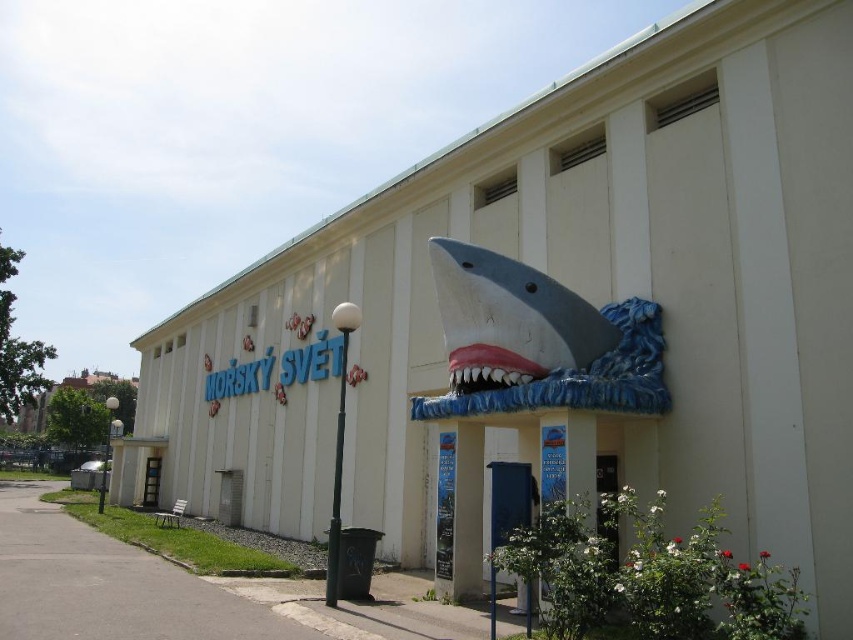
Question: Which of the following is the closest to the observer?

Choices:
 (A) white matte shark at center
 (B) pink glossy jaw at center

Answer: (A)

Question: Considering the relative positions of white matte shark at center and pink glossy jaw at center in the image provided, where is white matte shark at center located with respect to pink glossy jaw at center?

Choices:
 (A) below
 (B) above

Answer: (B)

Question: Can you confirm if white matte shark at center is wider than pink glossy jaw at center?

Choices:
 (A) no
 (B) yes

Answer: (B)

Question: Among these objects, which one is nearest to the camera?

Choices:
 (A) white matte shark at center
 (B) pink glossy jaw at center

Answer: (A)

Question: Does white matte shark at center have a smaller size compared to pink glossy jaw at center?

Choices:
 (A) no
 (B) yes

Answer: (A)